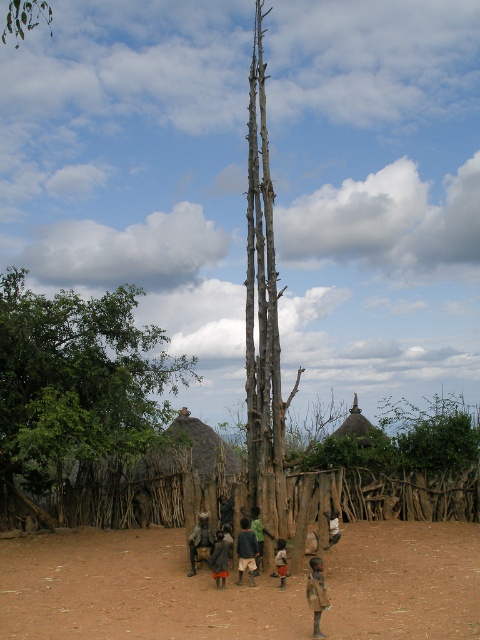
Question: Is dark brown wooden person at center to the left of brown fabric person at center from the viewer's perspective?

Choices:
 (A) no
 (B) yes

Answer: (B)

Question: Is brown fabric dress at center bigger than brown fabric person at center?

Choices:
 (A) no
 (B) yes

Answer: (A)

Question: Is brown fabric bag at lower center wider than brown fabric dress at center?

Choices:
 (A) yes
 (B) no

Answer: (A)

Question: Which point is closer to the camera?

Choices:
 (A) (28, 611)
 (B) (283, 566)
 (C) (333, 538)
 (D) (240, 552)

Answer: (A)

Question: Which object appears closest to the camera in this image?

Choices:
 (A) green leafy tree at left
 (B) brown dirt field at center
 (C) dark brown fabric at center
 (D) brown fabric dress at center

Answer: (B)

Question: Among these points, which one is farthest from the camera?

Choices:
 (A) (320, 592)
 (B) (148, 349)
 (C) (265, 618)
 (D) (219, 541)

Answer: (B)